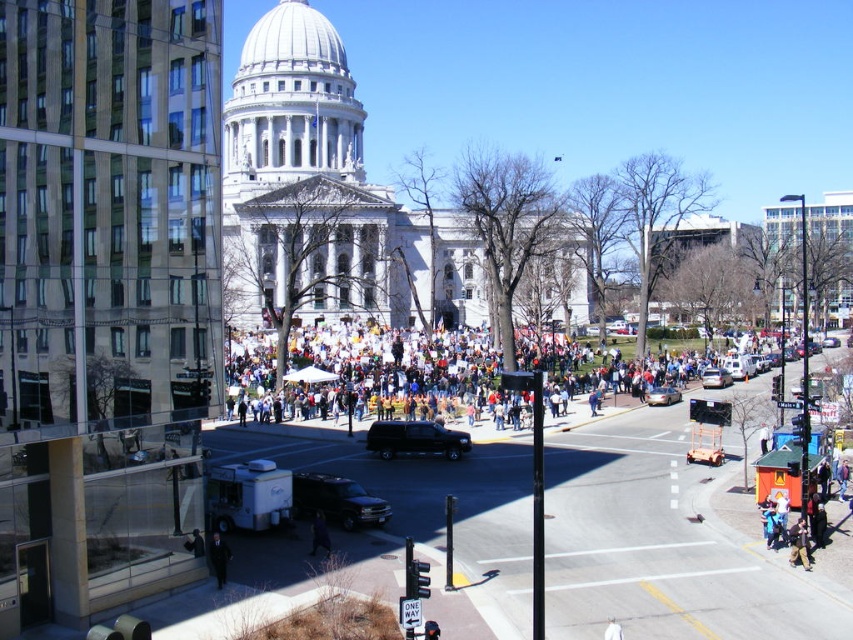
Measure the distance from dark fabric coat at lower center to white fabric person at center.

dark fabric coat at lower center and white fabric person at center are 85.59 feet apart.

Can you confirm if dark fabric coat at lower center is smaller than white fabric person at center?

No, dark fabric coat at lower center is not smaller than white fabric person at center.

Is point (196, 531) behind point (618, 637)?

Yes, point (196, 531) is farther from viewer.

Identify the location of dark fabric coat at lower center. The image size is (853, 640). (195, 544).

Between point (358, 513) and point (222, 573), which one is positioned in front?

Positioned in front is point (222, 573).

Is dark gray matte suv at lower center wider than dark blue suit at lower center?

Yes, dark gray matte suv at lower center is wider than dark blue suit at lower center.

Which is behind, point (303, 506) or point (213, 540)?

Point (303, 506)

Where is `dark gray matte suv at lower center`? The image size is (853, 640). dark gray matte suv at lower center is located at coordinates (335, 500).

Is dark gray matte suv at lower center to the right of black glossy suv at center from the viewer's perspective?

In fact, dark gray matte suv at lower center is to the left of black glossy suv at center.

Measure the distance from dark gray matte suv at lower center to black glossy suv at center.

They are 39.17 feet apart.

Who is more forward, [305,476] or [416,442]?

Point [305,476] is in front.

This screenshot has width=853, height=640. In order to click on dark gray matte suv at lower center in this screenshot , I will do `click(335, 500)`.